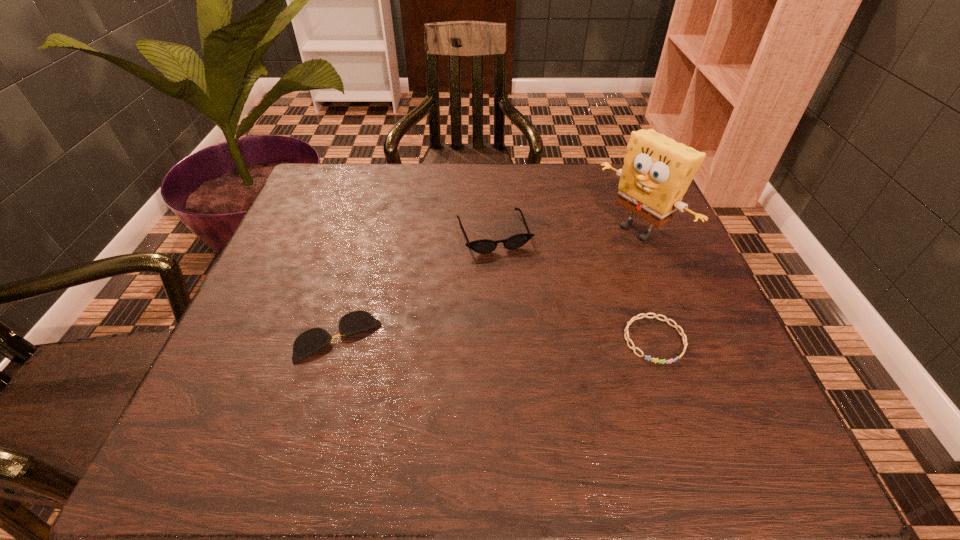
At what (x,y) coordinates should I click in order to perform the action: click on vacant region located 0.360m on the face of the sponge. Please return your answer as a coordinate pair (x, y). Looking at the image, I should click on (490, 323).

At what (x,y) coordinates should I click in order to perform the action: click on vacant space located 0.330m on the front-facing side of the third shortest object. Please return your answer as a coordinate pair (x, y). This screenshot has height=540, width=960. Looking at the image, I should click on (553, 381).

Find the location of a particular element. Image resolution: width=960 pixels, height=540 pixels. free space located 0.050m on the front-facing side of the third shortest object is located at coordinates (510, 271).

I want to click on blank space located on the front-facing side of the third shortest object, so click(534, 332).

Locate an element on the screen. This screenshot has height=540, width=960. sponge that is at the far edge is located at coordinates (657, 171).

Find the location of a particular element. sunglasses at the far edge is located at coordinates (483, 246).

Find the location of a particular element. This screenshot has width=960, height=540. spectacles that is at the near edge is located at coordinates (314, 339).

This screenshot has height=540, width=960. I want to click on bracelet situated at the near edge, so tap(676, 326).

You are a GUI agent. You are given a task and a screenshot of the screen. Output one action in this format:
    pyautogui.click(x=<x>, y=<y>)
    Task: Click on the object located at the left edge
    The width and height of the screenshot is (960, 540).
    Given the screenshot: What is the action you would take?
    pyautogui.click(x=314, y=339)

This screenshot has width=960, height=540. Identify the location of bracelet situated at the right edge. (676, 326).